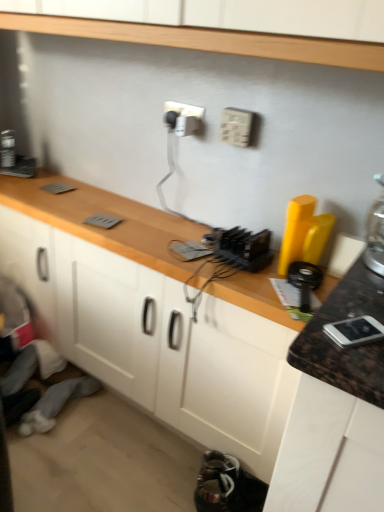
At what (x,y) coordinates should I click in order to perform the action: click on empty space that is ontop of wooden at center (from a real-world perspective). Please return your answer as a coordinate pair (x, y). This screenshot has width=384, height=512. Looking at the image, I should click on (161, 229).